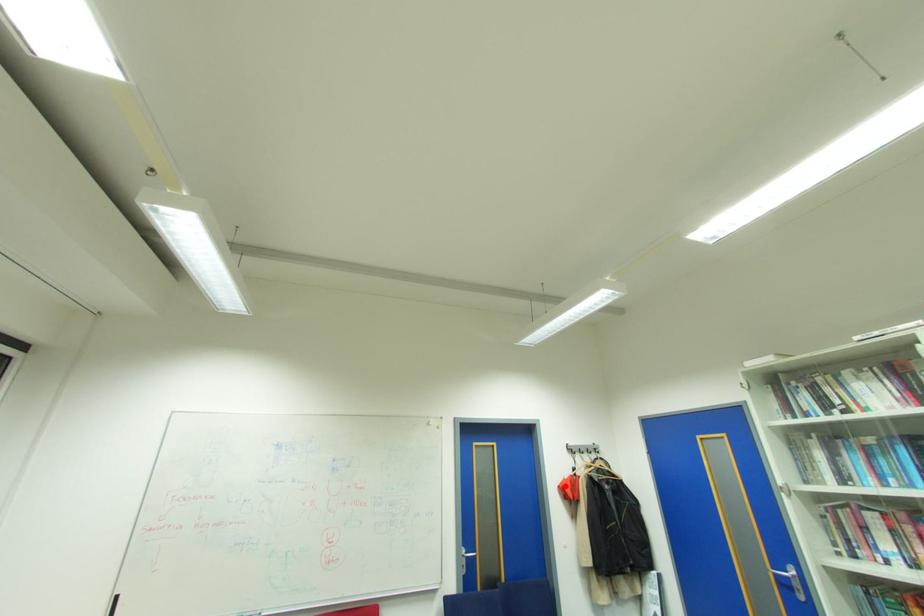
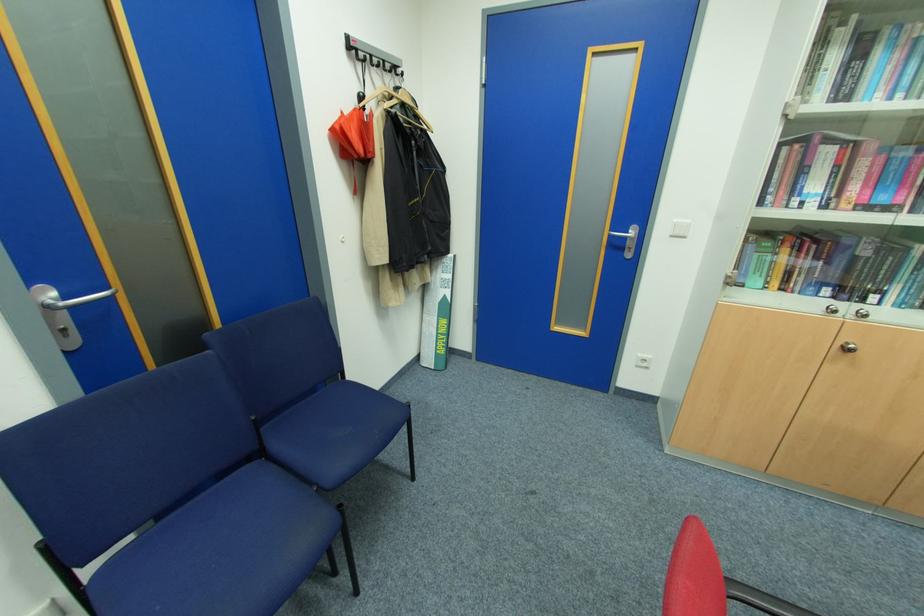
Locate, in the second image, the point that corresponds to the highlighted location in the first image.

(341, 127)